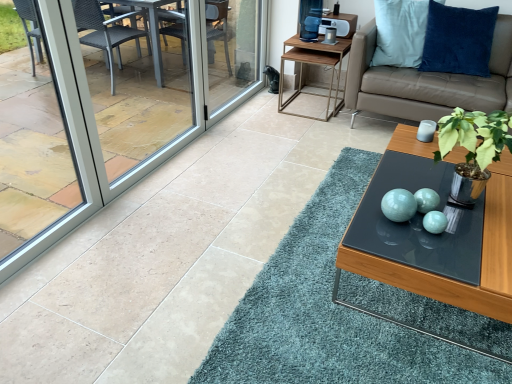
Question: Considering the relative sizes of wooden side table at upper right and matte glass coffee table at center in the image provided, is wooden side table at upper right taller than matte glass coffee table at center?

Choices:
 (A) yes
 (B) no

Answer: (A)

Question: Is wooden side table at upper right positioned in front of matte glass coffee table at center?

Choices:
 (A) no
 (B) yes

Answer: (A)

Question: Considering the relative positions of wooden side table at upper right and matte glass coffee table at center in the image provided, is wooden side table at upper right to the left of matte glass coffee table at center from the viewer's perspective?

Choices:
 (A) no
 (B) yes

Answer: (B)

Question: Is wooden side table at upper right not inside matte glass coffee table at center?

Choices:
 (A) yes
 (B) no

Answer: (A)

Question: Considering the relative sizes of wooden side table at upper right and matte glass coffee table at center in the image provided, is wooden side table at upper right thinner than matte glass coffee table at center?

Choices:
 (A) yes
 (B) no

Answer: (A)

Question: Is clear glass screen door at left, which is the second screen door from right to left, wider or thinner than transparent glass window at left?

Choices:
 (A) wide
 (B) thin

Answer: (B)

Question: Is clear glass screen door at left, which is the second screen door from right to left, situated inside transparent glass window at left or outside?

Choices:
 (A) inside
 (B) outside

Answer: (B)

Question: Is clear glass screen door at left, which is counted as the 1th screen door, starting from the left, in front of or behind transparent glass window at left in the image?

Choices:
 (A) front
 (B) behind

Answer: (B)

Question: Is clear glass screen door at left, which is counted as the 1th screen door, starting from the left, bigger or smaller than transparent glass window at left?

Choices:
 (A) small
 (B) big

Answer: (A)

Question: Is beige leather couch at upper right inside or outside of velvet blue pillow at upper right?

Choices:
 (A) outside
 (B) inside

Answer: (A)

Question: Is beige leather couch at upper right wider or thinner than velvet blue pillow at upper right?

Choices:
 (A) wide
 (B) thin

Answer: (A)

Question: In terms of size, does beige leather couch at upper right appear bigger or smaller than velvet blue pillow at upper right?

Choices:
 (A) big
 (B) small

Answer: (A)

Question: In the image, is beige leather couch at upper right positioned in front of or behind velvet blue pillow at upper right?

Choices:
 (A) front
 (B) behind

Answer: (A)

Question: Relative to wooden side table at upper right, is green leafy plant in metallic pot at center-right in front or behind?

Choices:
 (A) behind
 (B) front

Answer: (B)

Question: From their relative heights in the image, would you say green leafy plant in metallic pot at center-right is taller or shorter than wooden side table at upper right?

Choices:
 (A) tall
 (B) short

Answer: (B)